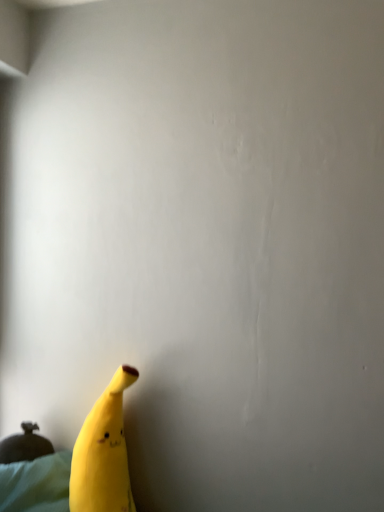
Locate an element on the screen. The width and height of the screenshot is (384, 512). yellow matte banana at lower left is located at coordinates (103, 453).

What do you see at coordinates (103, 453) in the screenshot? I see `yellow matte banana at lower left` at bounding box center [103, 453].

Describe the element at coordinates (36, 484) in the screenshot. This screenshot has height=512, width=384. I see `matte green sheet at lower left` at that location.

Locate an element on the screen. The height and width of the screenshot is (512, 384). matte green sheet at lower left is located at coordinates (36, 484).

At what (x,y) coordinates should I click in order to perform the action: click on yellow matte banana at lower left. Please return your answer as a coordinate pair (x, y). Looking at the image, I should click on (103, 453).

Can you confirm if matte green sheet at lower left is positioned to the left of yellow matte banana at lower left?

Indeed, matte green sheet at lower left is positioned on the left side of yellow matte banana at lower left.

Between matte green sheet at lower left and yellow matte banana at lower left, which one is positioned in front?

yellow matte banana at lower left is closer to the camera.

Is point (46, 473) closer to camera compared to point (91, 435)?

No, (46, 473) is behind (91, 435).

From the image's perspective, is matte green sheet at lower left beneath yellow matte banana at lower left?

Yes, from the image's perspective, matte green sheet at lower left is below yellow matte banana at lower left.

From a real-world perspective, between matte green sheet at lower left and yellow matte banana at lower left, who is vertically higher?

yellow matte banana at lower left, from a real-world perspective.

Which of these two, matte green sheet at lower left or yellow matte banana at lower left, is wider?

With larger width is yellow matte banana at lower left.

Which of these two, matte green sheet at lower left or yellow matte banana at lower left, stands shorter?

With less height is matte green sheet at lower left.

Considering the relative sizes of matte green sheet at lower left and yellow matte banana at lower left in the image provided, is matte green sheet at lower left smaller than yellow matte banana at lower left?

Yes.

Would you say matte green sheet at lower left is outside yellow matte banana at lower left?

Yes.

Is matte green sheet at lower left directly adjacent to yellow matte banana at lower left?

No, matte green sheet at lower left is not with yellow matte banana at lower left.

Is matte green sheet at lower left oriented towards yellow matte banana at lower left?

Yes, matte green sheet at lower left is oriented towards yellow matte banana at lower left.

How many degrees apart are the facing directions of matte green sheet at lower left and yellow matte banana at lower left?

The angle between the facing direction of matte green sheet at lower left and the facing direction of yellow matte banana at lower left is 0.000256 degrees.

The width and height of the screenshot is (384, 512). I want to click on banana above the matte green sheet at lower left (from the image's perspective), so click(x=103, y=453).

Based on the photo, which is more to the right, yellow matte banana at lower left or matte green sheet at lower left?

yellow matte banana at lower left is more to the right.

Which object is more forward, yellow matte banana at lower left or matte green sheet at lower left?

Positioned in front is yellow matte banana at lower left.

Which is less distant, (122,451) or (19,462)?

Point (122,451).

From the image's perspective, which is above, yellow matte banana at lower left or matte green sheet at lower left?

yellow matte banana at lower left.

From a real-world perspective, is yellow matte banana at lower left physically located above or below matte green sheet at lower left?

yellow matte banana at lower left is situated higher than matte green sheet at lower left in the real world.

Based on the photo, in terms of width, does yellow matte banana at lower left look wider or thinner when compared to matte green sheet at lower left?

yellow matte banana at lower left is wider than matte green sheet at lower left.

Who is taller, yellow matte banana at lower left or matte green sheet at lower left?

yellow matte banana at lower left.

Is yellow matte banana at lower left bigger or smaller than matte green sheet at lower left?

yellow matte banana at lower left is bigger than matte green sheet at lower left.

Choose the correct answer: Is yellow matte banana at lower left inside matte green sheet at lower left or outside it?

yellow matte banana at lower left cannot be found inside matte green sheet at lower left.

Is yellow matte banana at lower left placed right next to matte green sheet at lower left?

No, yellow matte banana at lower left is not in contact with matte green sheet at lower left.

In the scene shown: Is yellow matte banana at lower left positioned with its back to matte green sheet at lower left?

No.

Can you tell me how much yellow matte banana at lower left and matte green sheet at lower left differ in facing direction?

They differ by 0.000256 degrees in their facing directions.

This screenshot has height=512, width=384. Find the location of `banana on the right side of matte green sheet at lower left`. banana on the right side of matte green sheet at lower left is located at coordinates (103, 453).

Find the location of a particular element. The width and height of the screenshot is (384, 512). sheet below the yellow matte banana at lower left (from a real-world perspective) is located at coordinates (36, 484).

Find the location of a particular element. This screenshot has width=384, height=512. banana in front of the matte green sheet at lower left is located at coordinates (103, 453).